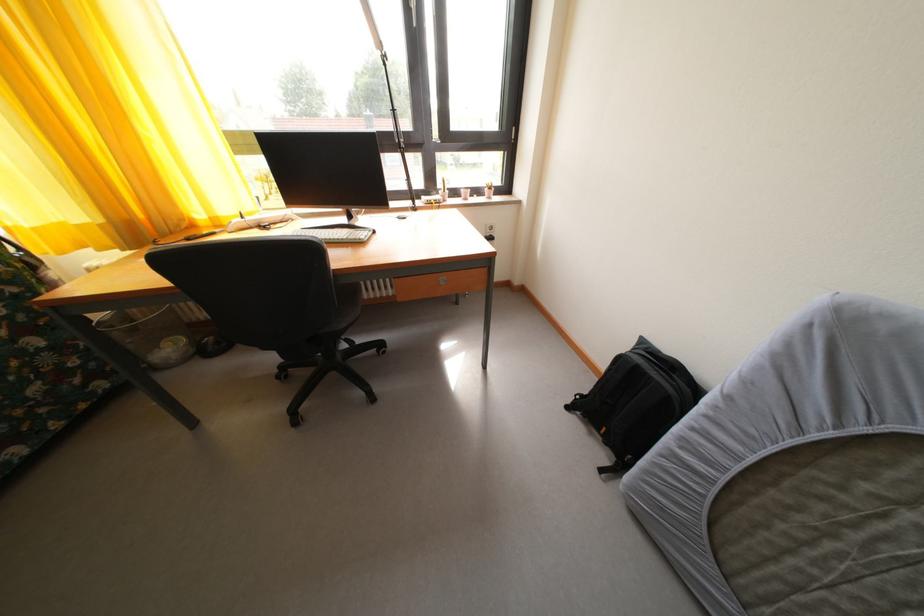
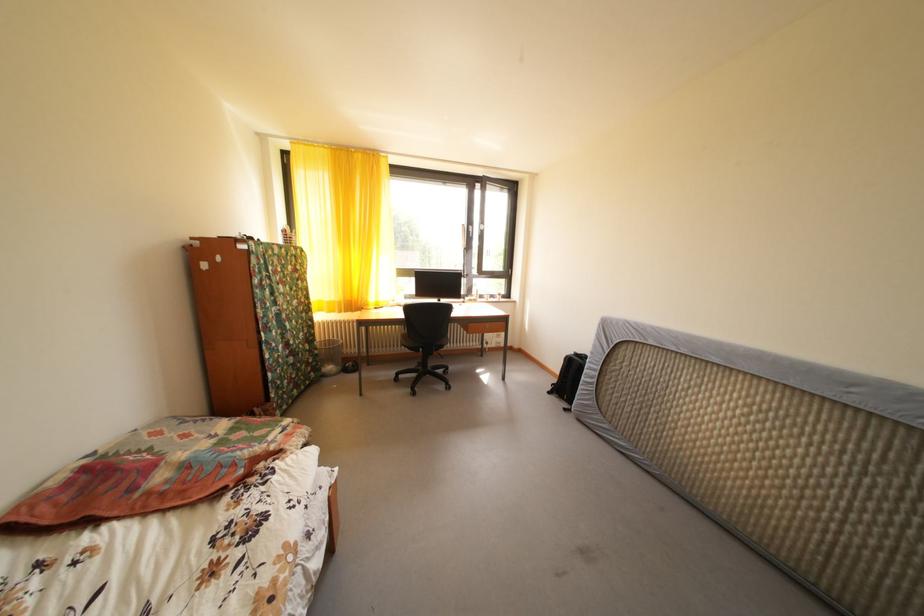
Question: The images are taken continuously from a first-person perspective. In which direction are you moving?

Choices:
 (A) Left
 (B) Right
 (C) Forward
 (D) Backward

Answer: (D)